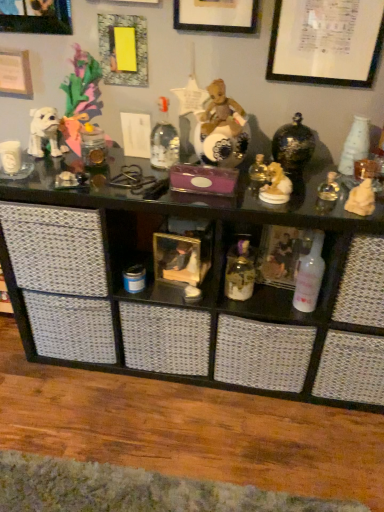
Locate an element on the screen. The image size is (384, 512). free space in front of black glass shelf at upper center, positioned as the second shelf in left-to-right order is located at coordinates (208, 446).